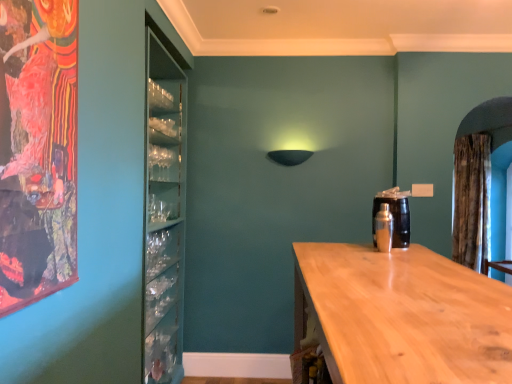
Question: Is light wood countertop at center shorter than silver metallic shaker at right?

Choices:
 (A) no
 (B) yes

Answer: (A)

Question: Is light wood countertop at center at the right side of silver metallic shaker at right?

Choices:
 (A) no
 (B) yes

Answer: (A)

Question: Is silver metallic shaker at right located within light wood countertop at center?

Choices:
 (A) no
 (B) yes

Answer: (A)

Question: Is light wood countertop at center aimed at silver metallic shaker at right?

Choices:
 (A) yes
 (B) no

Answer: (B)

Question: From the image's perspective, is light wood countertop at center over silver metallic shaker at right?

Choices:
 (A) yes
 (B) no

Answer: (B)

Question: Is light wood countertop at center further to camera compared to silver metallic shaker at right?

Choices:
 (A) no
 (B) yes

Answer: (A)

Question: Is brown textured curtain at right in front of light wood countertop at center?

Choices:
 (A) no
 (B) yes

Answer: (A)

Question: Does brown textured curtain at right appear on the right side of light wood countertop at center?

Choices:
 (A) yes
 (B) no

Answer: (A)

Question: Is brown textured curtain at right at the left side of light wood countertop at center?

Choices:
 (A) no
 (B) yes

Answer: (A)

Question: Does brown textured curtain at right come behind light wood countertop at center?

Choices:
 (A) no
 (B) yes

Answer: (B)

Question: From a real-world perspective, is brown textured curtain at right positioned under light wood countertop at center based on gravity?

Choices:
 (A) yes
 (B) no

Answer: (B)

Question: From a real-world perspective, is brown textured curtain at right physically above light wood countertop at center?

Choices:
 (A) yes
 (B) no

Answer: (A)

Question: Is brown textured curtain at right smaller than silver metallic shaker at right?

Choices:
 (A) no
 (B) yes

Answer: (A)